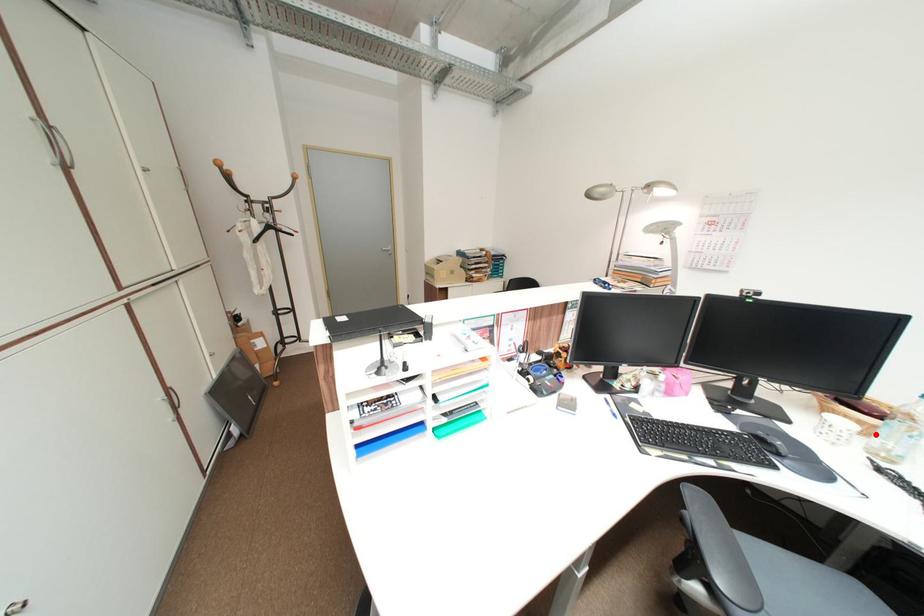
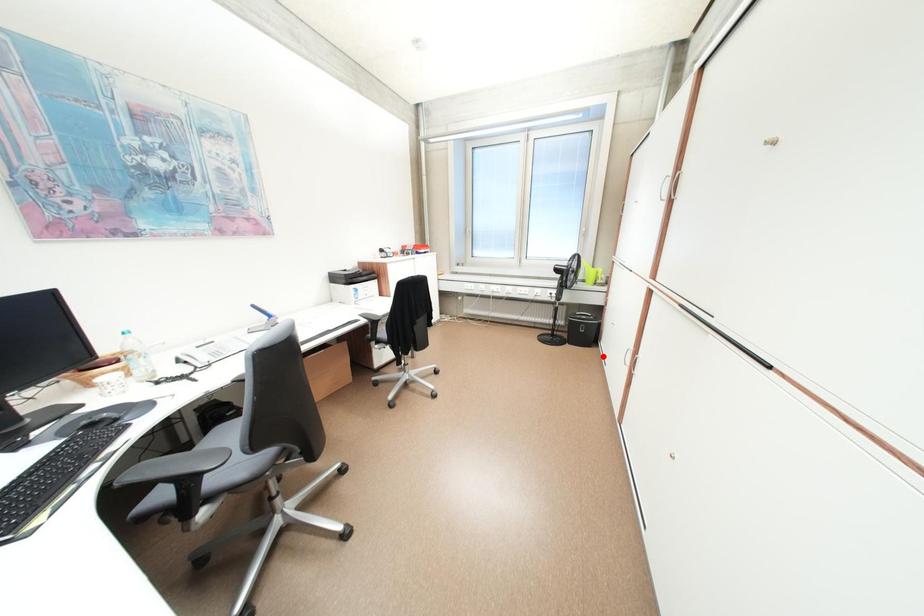
I am providing you with two images of the same scene from different viewpoints. A red point is marked on the first image and another point is marked on the second image. Is the marked point in image1 the same physical position as the marked point in image2?

No